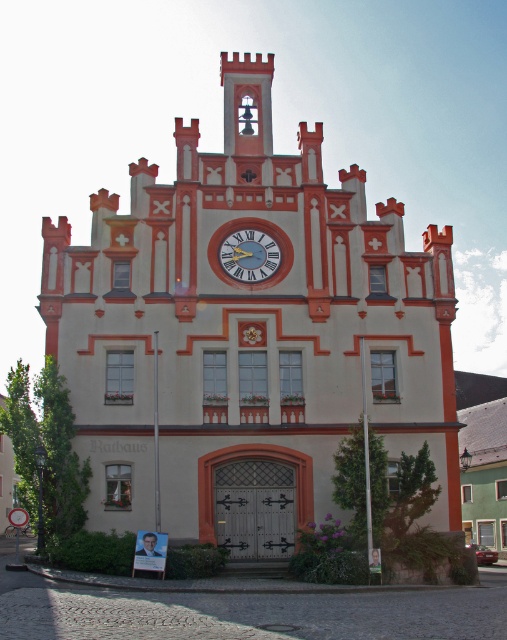
Question: Can you confirm if white painted stone church at center is bigger than metallic clock face at center?

Choices:
 (A) no
 (B) yes

Answer: (B)

Question: Observing the image, what is the correct spatial positioning of white painted stone church at center in reference to metallic clock face at center?

Choices:
 (A) right
 (B) left

Answer: (A)

Question: Which point is farther from the camera taking this photo?

Choices:
 (A) (261, 264)
 (B) (302, 308)

Answer: (A)

Question: Among these points, which one is farthest from the camera?

Choices:
 (A) (245, 356)
 (B) (257, 275)

Answer: (B)

Question: Among these objects, which one is nearest to the camera?

Choices:
 (A) metallic clock face at center
 (B) white painted stone church at center

Answer: (B)

Question: Does white painted stone church at center appear on the right side of metallic clock face at center?

Choices:
 (A) no
 (B) yes

Answer: (B)